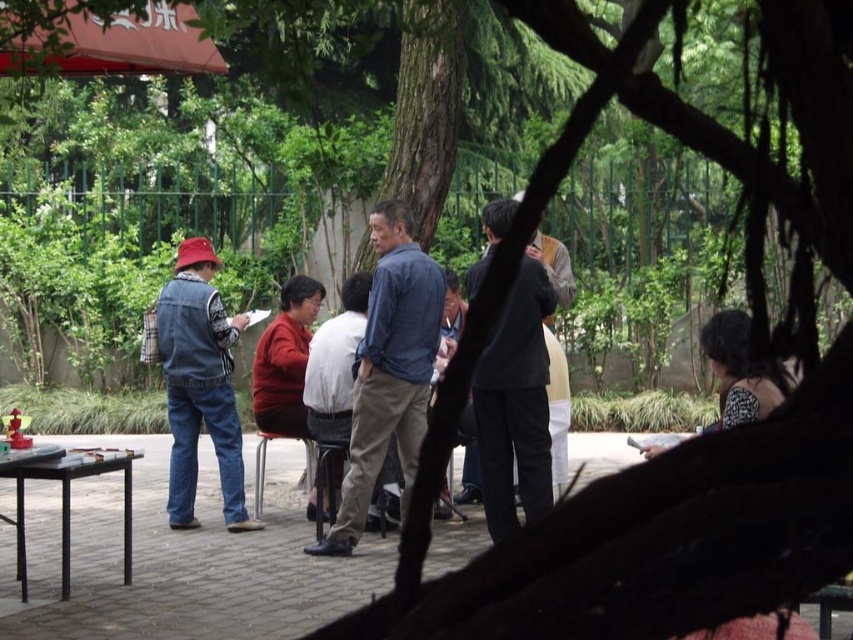
Question: Estimate the real-world distances between objects in this image. Which object is closer to the blue denim shirt at center?

Choices:
 (A) dark gray suit at center
 (B) metallic black picnic table at lower left
 (C) denim jacket at left

Answer: (A)

Question: Can you confirm if blue denim shirt at center is positioned to the left of black plastic table at lower left?

Choices:
 (A) no
 (B) yes

Answer: (A)

Question: Which of these objects is positioned closest to the denim jacket at left?

Choices:
 (A) dark gray suit at center
 (B) denim jacket at center

Answer: (B)

Question: Does dark gray suit at center have a greater width compared to denim jacket at center?

Choices:
 (A) yes
 (B) no

Answer: (A)

Question: Does denim jacket at left come behind metallic black picnic table at lower left?

Choices:
 (A) yes
 (B) no

Answer: (A)

Question: Among these objects, which one is farthest from the camera?

Choices:
 (A) black plastic table at lower left
 (B) dark gray suit at center

Answer: (B)